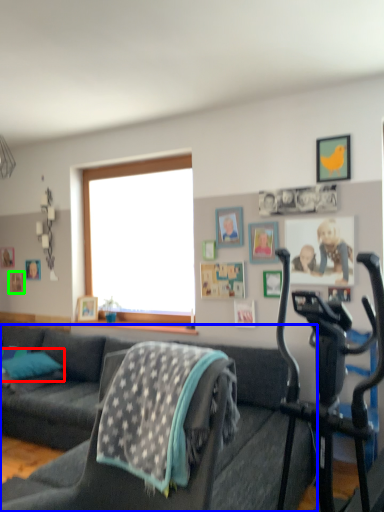
Question: Estimate the real-world distances between objects in this image. Which object is closer to pillow (highlighted by a red box), studio couch (highlighted by a blue box) or picture frame (highlighted by a green box)?

Choices:
 (A) studio couch
 (B) picture frame

Answer: (A)